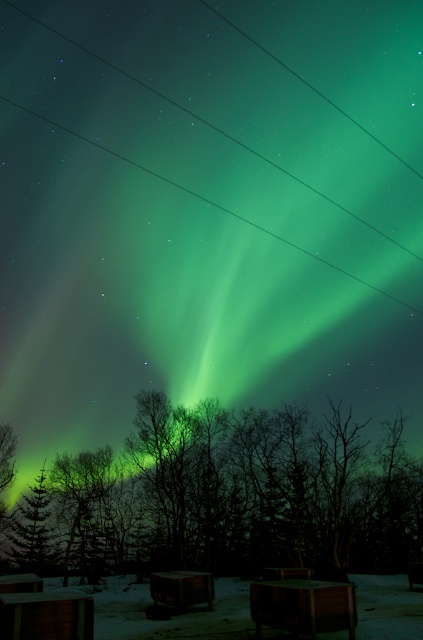
Which is more to the left, green leafy tree at center or green matte tree at lower left?

green matte tree at lower left

Does green leafy tree at center have a greater width compared to green matte tree at lower left?

Indeed, green leafy tree at center has a greater width compared to green matte tree at lower left.

Is point (332, 403) in front of point (32, 486)?

Yes, it is.

This screenshot has height=640, width=423. What are the coordinates of `green leafy tree at center` in the screenshot? It's located at (225, 497).

Is green leafy tree at center to the right of transparent glass power lines at upper center from the viewer's perspective?

In fact, green leafy tree at center is to the left of transparent glass power lines at upper center.

Between green leafy tree at center and transparent glass power lines at upper center, which one appears on the left side from the viewer's perspective?

green leafy tree at center

Is point (261, 520) positioned after point (263, 230)?

No, it is in front of (263, 230).

I want to click on green leafy tree at center, so click(225, 497).

Is green matte tree at lower left below transparent glass power lines at upper center?

Yes.

Between point (40, 545) and point (275, 164), which one is positioned in front?

Point (40, 545) is in front.

Where is `green matte tree at lower left`? This screenshot has width=423, height=640. green matte tree at lower left is located at coordinates (30, 532).